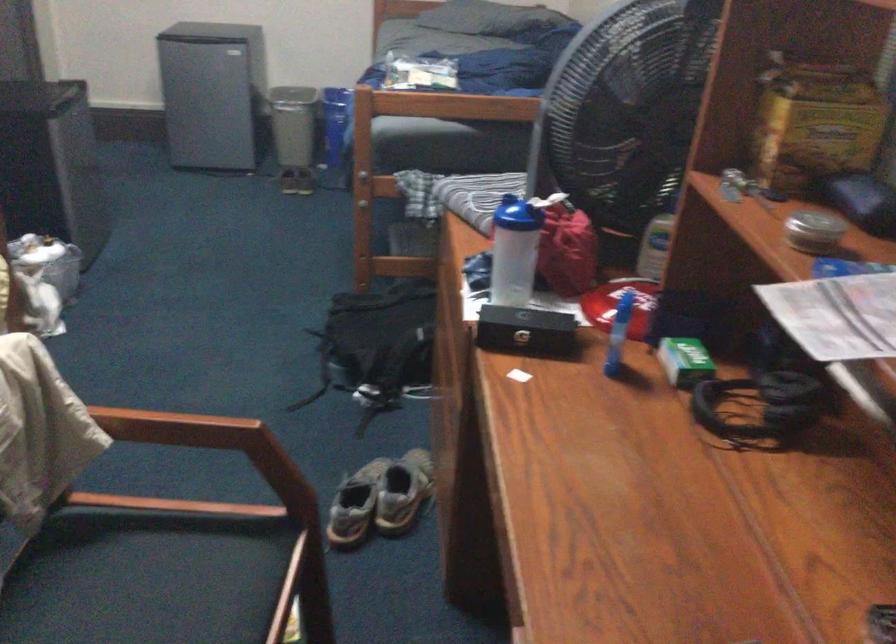
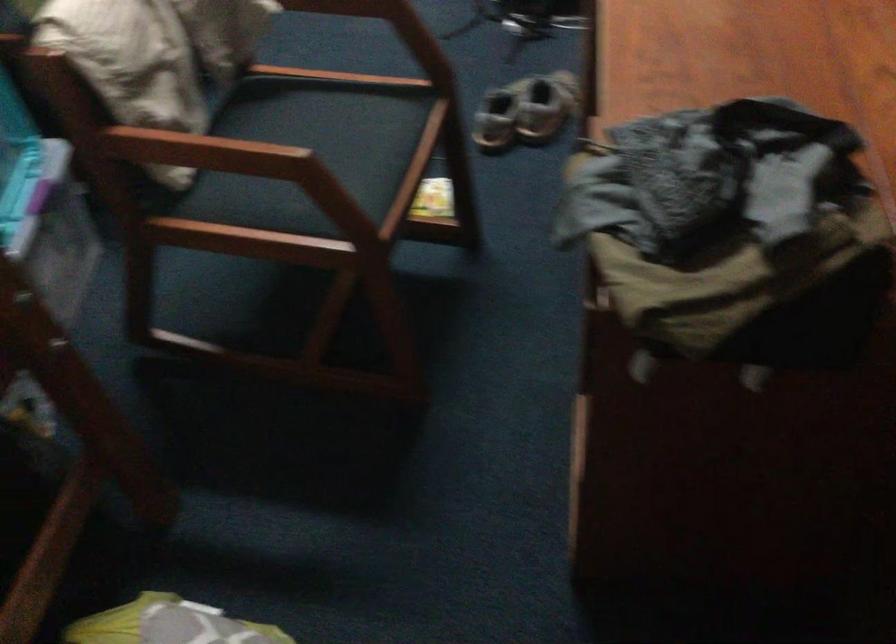
Consider the image. Which direction would the cameraman need to move to produce the second image?

The cameraman walked toward right, backward.